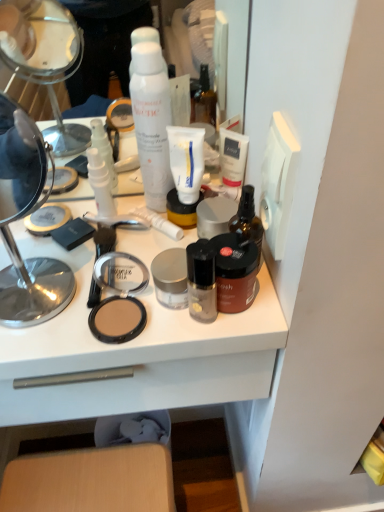
At what (x,y) coordinates should I click in order to perform the action: click on free location to the left of white plastic tube at center, the fourth toiletry positioned from the right. Please return your answer as a coordinate pair (x, y). This screenshot has width=384, height=512. Looking at the image, I should click on [x=79, y=241].